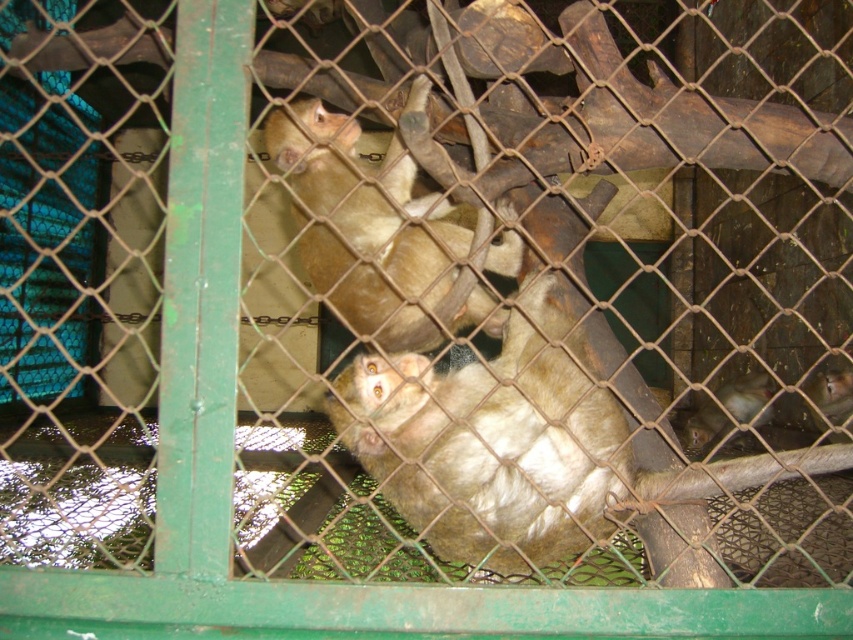
Which of these two, brown wood at upper center or fuzzy brown monkey at lower right, stands shorter?

fuzzy brown monkey at lower right

Does brown wood at upper center have a lesser width compared to fuzzy brown monkey at lower right?

Incorrect, brown wood at upper center's width is not less than fuzzy brown monkey at lower right's.

Between point (699, 157) and point (715, 410), which one is positioned behind?

Positioned behind is point (715, 410).

You are a GUI agent. You are given a task and a screenshot of the screen. Output one action in this format:
    pyautogui.click(x=<x>, y=<y>)
    Task: Click on the brown wood at upper center
    
    Given the screenshot: What is the action you would take?
    pyautogui.click(x=642, y=125)

Who is lower down, fuzzy brown monkey at center or fuzzy brown monkey at lower right?

fuzzy brown monkey at lower right is lower down.

Which is in front, point (383, 336) or point (751, 388)?

Point (383, 336) is more forward.

This screenshot has height=640, width=853. What are the coordinates of `fuzzy brown monkey at center` in the screenshot? It's located at (364, 225).

Between brown wood at upper center and fuzzy brown monkey at center, which one has more height?

fuzzy brown monkey at center is taller.

Between brown wood at upper center and fuzzy brown monkey at center, which one has less height?

brown wood at upper center is shorter.

Is point (49, 45) less distant than point (361, 262)?

No, it is behind (361, 262).

Find the location of a particular element. The height and width of the screenshot is (640, 853). brown wood at upper center is located at coordinates (642, 125).